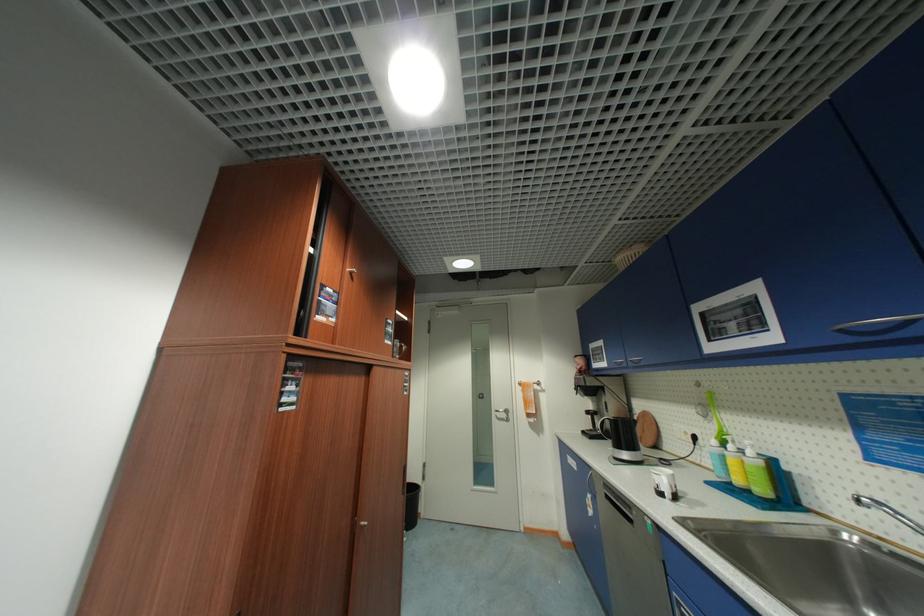
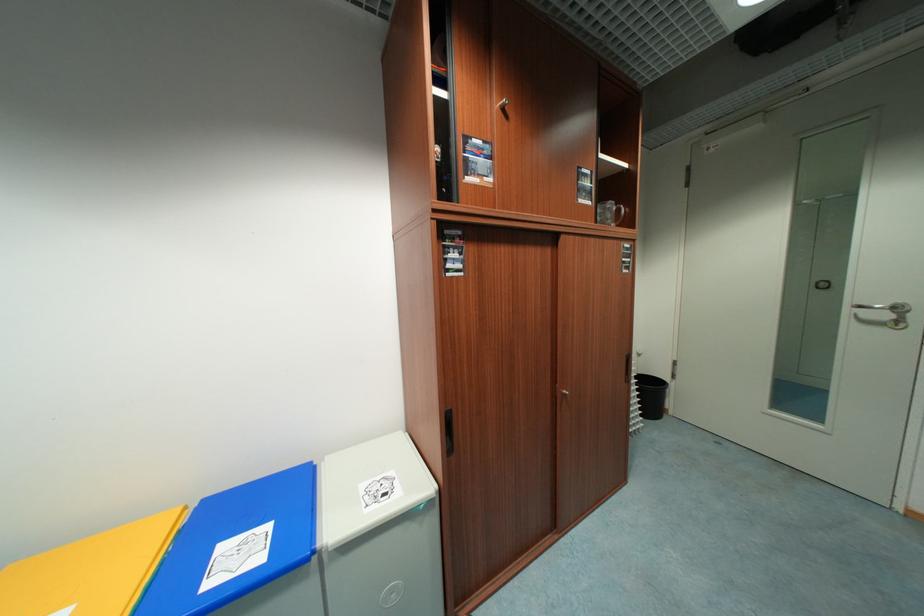
Locate, in the second image, the point that corresponds to (x=513, y=411) in the first image.

(904, 310)